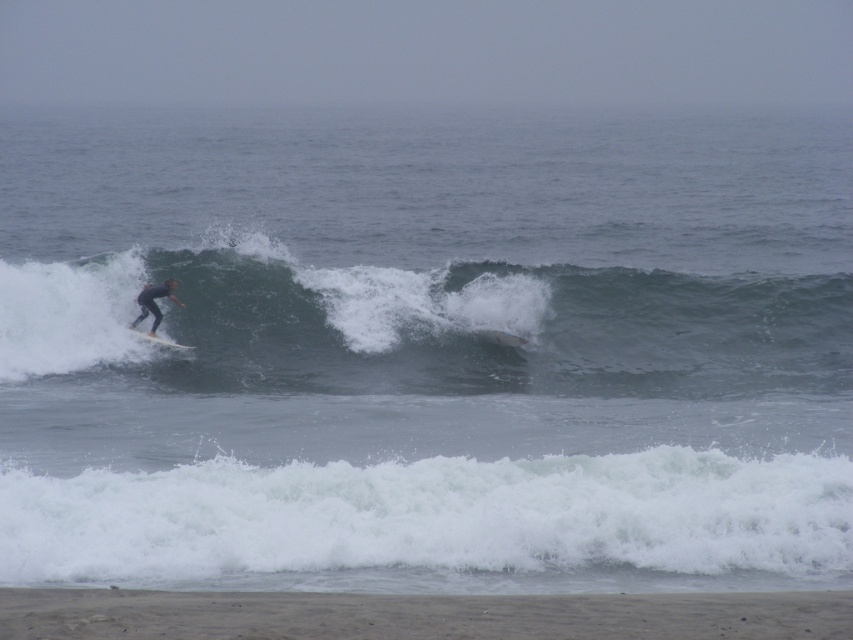
Where is `dark blue wetsuit at center`? dark blue wetsuit at center is located at coordinates (154, 301).

Does dark blue wetsuit at center appear over white matte surfboard at left?

Yes.

What do you see at coordinates (154, 301) in the screenshot? The height and width of the screenshot is (640, 853). I see `dark blue wetsuit at center` at bounding box center [154, 301].

This screenshot has width=853, height=640. I want to click on dark blue wetsuit at center, so tap(154, 301).

Is smooth gray wave at center positioned at the back of white matte surfboard at left?

No.

Can you confirm if smooth gray wave at center is smaller than white matte surfboard at left?

No.

This screenshot has height=640, width=853. I want to click on smooth gray wave at center, so click(x=432, y=324).

Is point (827, 340) farther from camera compared to point (154, 296)?

Yes, point (827, 340) is behind point (154, 296).

What do you see at coordinates (432, 324) in the screenshot? I see `smooth gray wave at center` at bounding box center [432, 324].

The image size is (853, 640). In order to click on smooth gray wave at center in this screenshot , I will do `click(432, 324)`.